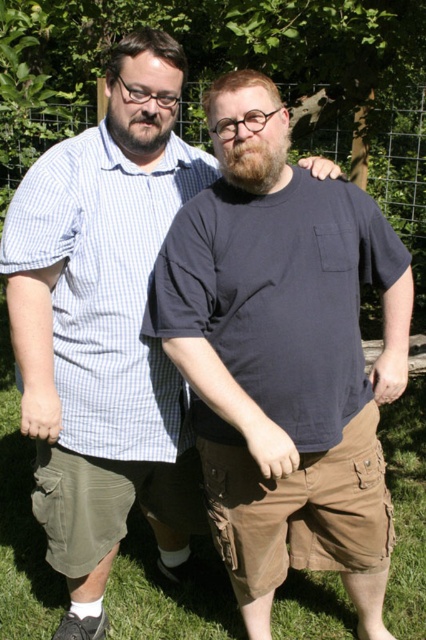
Question: Does dark blue cotton t-shirt at center appear over green grass at lower center?

Choices:
 (A) yes
 (B) no

Answer: (A)

Question: Can you confirm if dark blue cotton t-shirt at center is positioned above wire mesh fence at upper center?

Choices:
 (A) no
 (B) yes

Answer: (A)

Question: Estimate the real-world distances between objects in this image. Which object is farther from the dark blue cotton t-shirt at center?

Choices:
 (A) wire mesh fence at upper center
 (B) green grass at lower center

Answer: (A)

Question: Among these points, which one is farthest from the camera?

Choices:
 (A) (344, 534)
 (B) (397, 496)
 (C) (393, 200)

Answer: (C)

Question: Estimate the real-world distances between objects in this image. Which object is closer to the green grass at lower center?

Choices:
 (A) dark blue cotton t-shirt at center
 (B) wire mesh fence at upper center

Answer: (A)

Question: Where is dark blue cotton t-shirt at center located in relation to wire mesh fence at upper center in the image?

Choices:
 (A) right
 (B) left

Answer: (B)